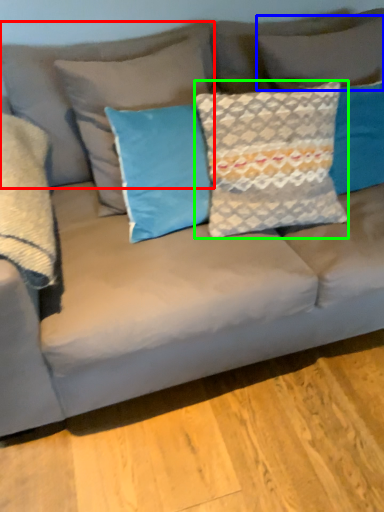
Question: Which is nearer to the pillow (highlighted by a red box)? pillow (highlighted by a blue box) or pillow (highlighted by a green box).

Choices:
 (A) pillow
 (B) pillow

Answer: (A)